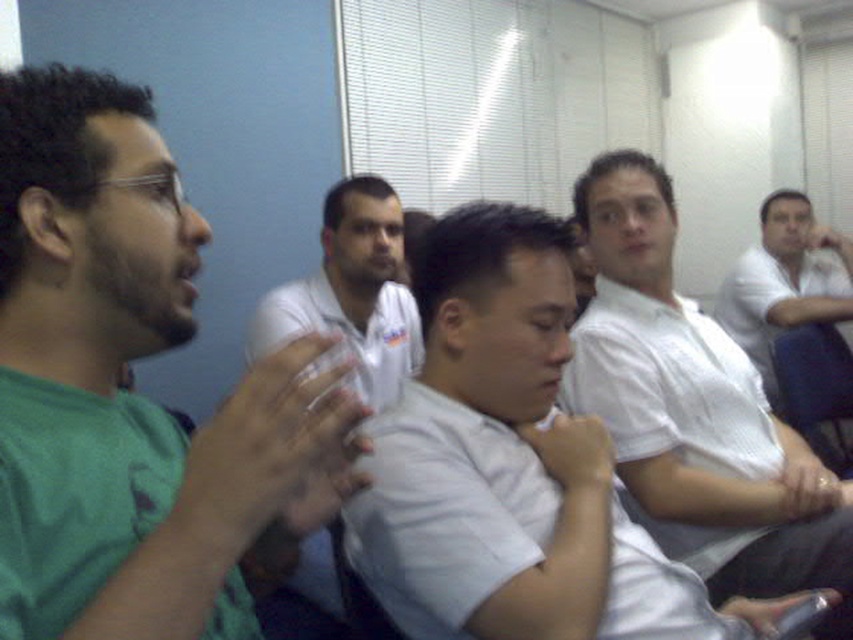
Question: Estimate the real-world distances between objects in this image. Which object is closer to the green matte shirt at left?

Choices:
 (A) white cotton shirt at center
 (B) white shirt at center

Answer: (A)

Question: Which of the following is the closest to the observer?

Choices:
 (A) white shirt at center
 (B) white cotton shirt at center
 (C) white shirt at right

Answer: (B)

Question: Does green matte shirt at left come behind white shirt at center?

Choices:
 (A) no
 (B) yes

Answer: (A)

Question: Which object appears farthest from the camera in this image?

Choices:
 (A) white shirt at right
 (B) white shirt at center
 (C) green matte shirt at left
 (D) white cotton shirt at center

Answer: (A)

Question: Observing the image, what is the correct spatial positioning of white cotton shirt at center in reference to white shirt at center?

Choices:
 (A) above
 (B) below

Answer: (B)

Question: Does green matte shirt at left have a smaller size compared to white shirt at right?

Choices:
 (A) no
 (B) yes

Answer: (B)